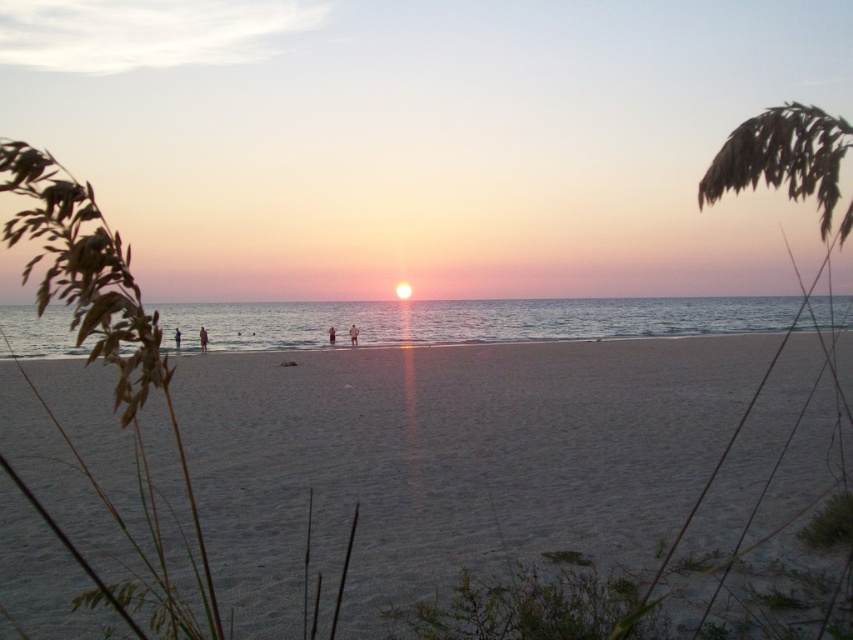
Is white sandy beach at center thinner than skinny jeans at center?

Incorrect, white sandy beach at center's width is not less than skinny jeans at center's.

Is point (618, 369) closer to viewer compared to point (354, 339)?

Yes.

Does point (827, 456) lie behind point (357, 336)?

No, (827, 456) is in front of (357, 336).

The width and height of the screenshot is (853, 640). I want to click on white sandy beach at center, so click(447, 460).

How much distance is there between orange fabric person at center and skinny jeans at center?

The distance of orange fabric person at center from skinny jeans at center is 10.08 meters.

Who is more distant from viewer, (201, 337) or (354, 332)?

Positioned behind is point (354, 332).

This screenshot has width=853, height=640. Describe the element at coordinates (202, 339) in the screenshot. I see `orange fabric person at center` at that location.

This screenshot has height=640, width=853. In order to click on orange fabric person at center in this screenshot , I will do `click(202, 339)`.

Is skinny jeans at center bigger than dark blue fabric person at center?

No, skinny jeans at center is not bigger than dark blue fabric person at center.

Which is below, skinny jeans at center or dark blue fabric person at center?

dark blue fabric person at center is lower down.

Image resolution: width=853 pixels, height=640 pixels. In order to click on skinny jeans at center in this screenshot , I will do `click(352, 333)`.